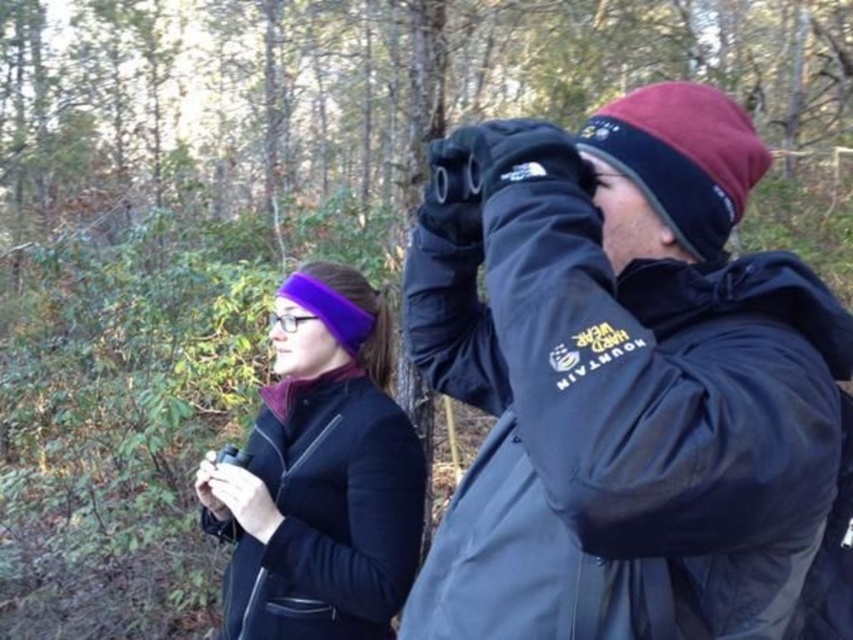
You are a photographer trying to capture both the matte black jacket at center and the purple fleece headband at center in a single frame. Based on their positions, which object should you adjust your camera focus to prioritize to ensure both are in the frame?

The matte black jacket at center is not as tall as the purple fleece headband at center, so you should adjust your camera focus to prioritize the purple fleece headband at center to ensure both are in the frame.

You are a photographer trying to capture both the matte black jacket at center and the purple fleece headband at center in the same frame. Based on their positions, which object should you adjust your camera angle to focus on first to ensure both are in the shot?

The matte black jacket at center is to the right of purple fleece headband at center, so you should adjust your camera angle to focus on the purple fleece headband at center first to ensure both are in the shot.